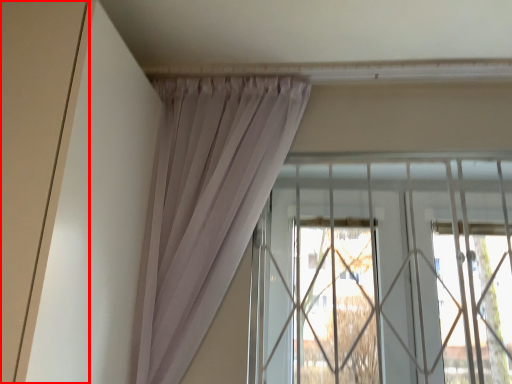
Question: From the image's perspective, where is door (annotated by the red box) located relative to window?

Choices:
 (A) below
 (B) above

Answer: (B)